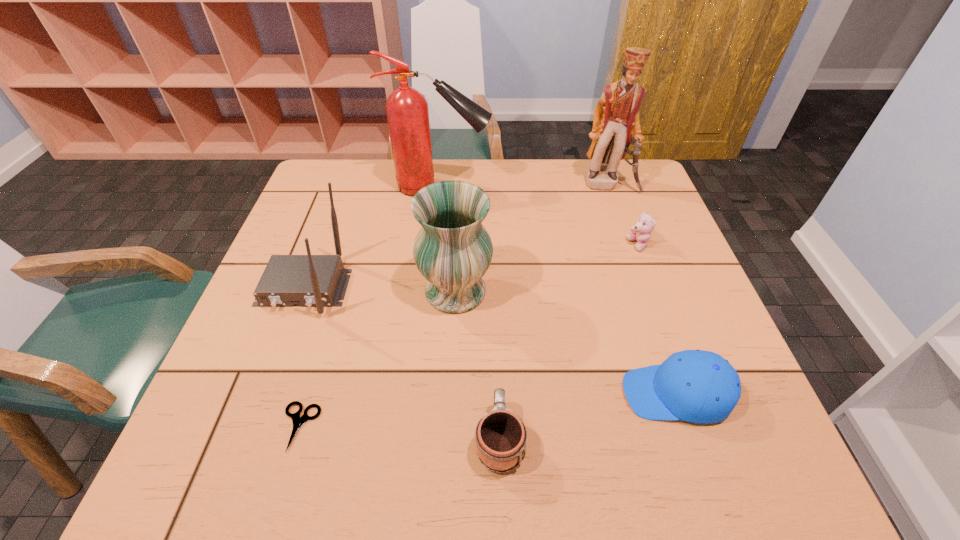
At what (x,y) coordinates should I click in order to perform the action: click on free region located 0.220m on the front of the vase. Please return your answer as a coordinate pair (x, y). This screenshot has height=540, width=960. Looking at the image, I should click on (449, 413).

You are a GUI agent. You are given a task and a screenshot of the screen. Output one action in this format:
    pyautogui.click(x=<x>, y=<y>)
    Task: Click on the vacant space positioned 0.350m on the back of the router to connect cables
    Image resolution: width=960 pixels, height=540 pixels.
    Given the screenshot: What is the action you would take?
    pyautogui.click(x=229, y=485)

Where is `vacant space situated 0.310m on the front-facing side of the cap`? The height and width of the screenshot is (540, 960). vacant space situated 0.310m on the front-facing side of the cap is located at coordinates (462, 394).

Where is `vacant region located 0.170m on the front-facing side of the cap`? This screenshot has width=960, height=540. vacant region located 0.170m on the front-facing side of the cap is located at coordinates (535, 394).

Find the location of a particular element. This screenshot has width=960, height=540. vacant space situated 0.050m on the front-facing side of the cap is located at coordinates (597, 394).

Identify the location of vacant space located 0.290m at the face of the sixth nearest object. (516, 245).

Locate an element on the screen. Image resolution: width=960 pixels, height=540 pixels. vacant space located at the face of the sixth nearest object is located at coordinates (489, 245).

Locate an element on the screen. The image size is (960, 540). free space located 0.260m at the face of the sixth nearest object is located at coordinates (527, 245).

Locate an element on the screen. The image size is (960, 540). vacant space located 0.290m on the side of the mug with the handle is located at coordinates (494, 291).

Find the location of a particular element. The image size is (960, 540). free space located on the side of the mug with the handle is located at coordinates coord(494,269).